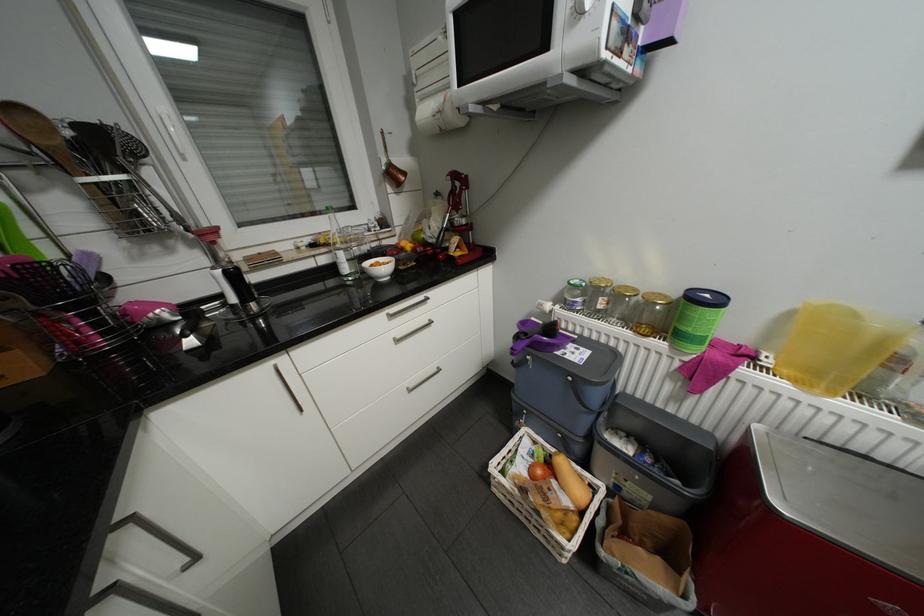
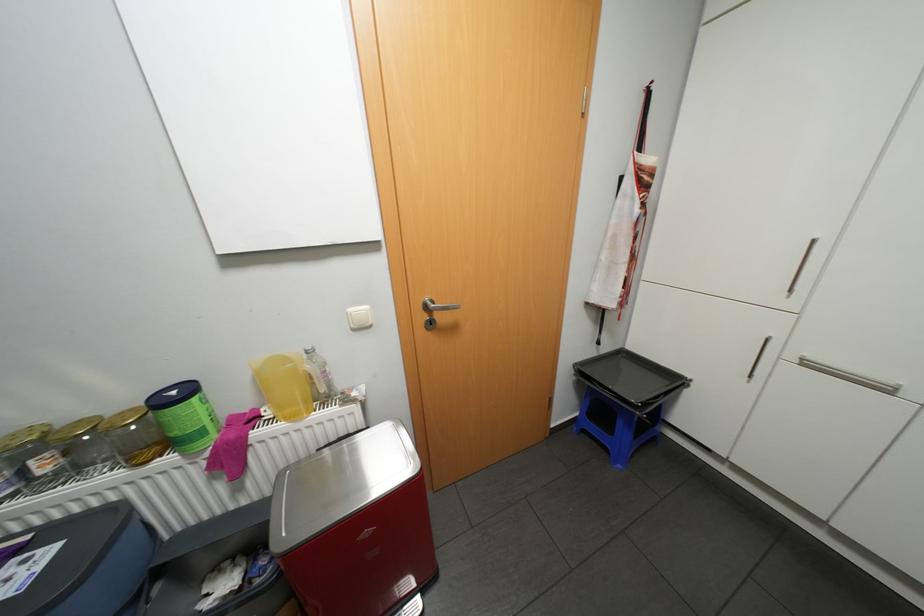
In the second image, find the point that corresponds to point (609, 297) in the first image.

(39, 461)